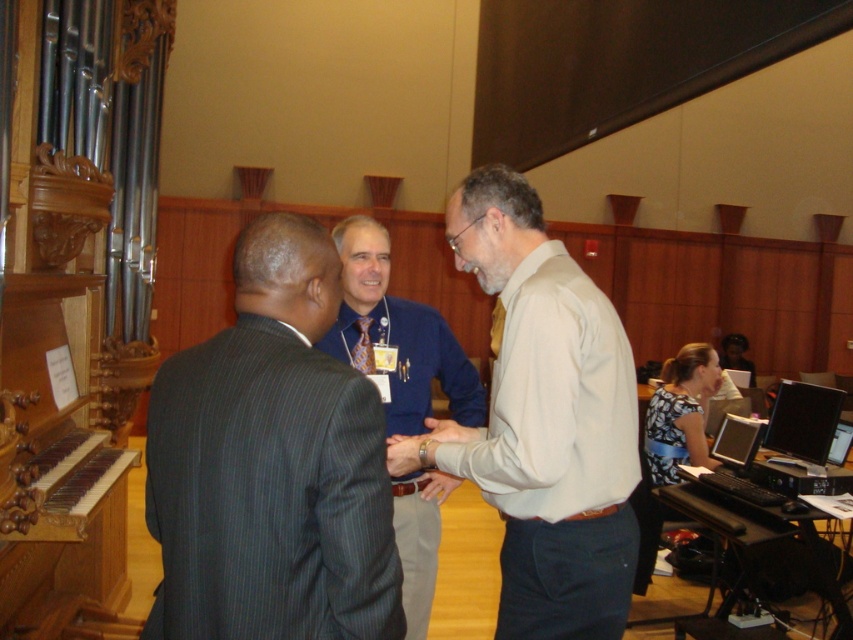
Where is the dark gray pinstripe suit at center located in the image?

The dark gray pinstripe suit at center is located at point (x=271, y=465).

You are attending a formal event and need to choose an outfit that is narrower. Based on the image, which one between the dark gray pinstripe suit at center and the blue shirt at center would you recommend?

The dark gray pinstripe suit at center has a lesser width compared to the blue shirt at center, so it is the narrower option and would be the better choice for a formal event requiring a slimmer look.